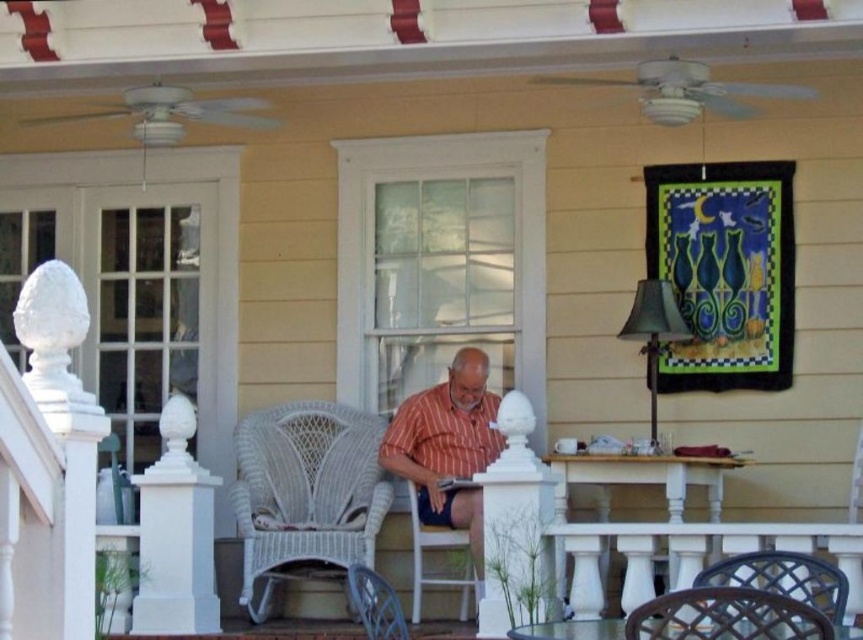
In the scene shown: You are standing on the porch and want to sit down. There are two chairs available. Which chair is closer to the center of the porch, the white wicker rocking chair at center or the wicker chair at lower center?

The white wicker rocking chair at center is closer to the center of the porch since it is positioned to the left of the wicker chair at lower center.

Based on the scene description, where is the white painted wood balustrade at lower center located in the image?

The white painted wood balustrade at lower center is located at point coordinates of (695, 554).

You are standing on the porch and want to pick up an item from the table. There are two points marked on the table surface. Which point is closer to you, point 1 at coordinates point (x=591, y=616) or point 2 at coordinates point (x=817, y=604)?

Point 1 at coordinates point (x=591, y=616) is closer to you because it is further to the camera than point 2 at coordinates point (x=817, y=604).